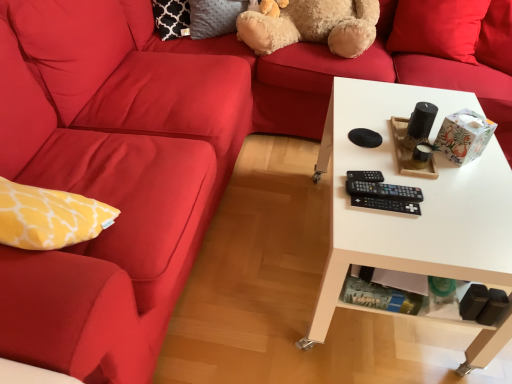
What are the coordinates of `free location in front of black plastic remote at center, placed as the third control when sorted from front to back` in the screenshot? It's located at (379, 216).